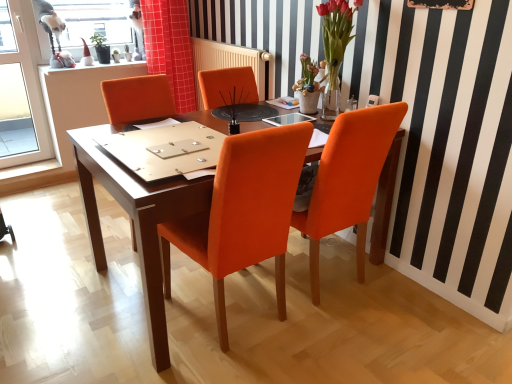
Question: Is wooden bulletin board at upper center surrounding orange leather chair at center, which ranks as the 2th chair in right-to-left order?

Choices:
 (A) yes
 (B) no

Answer: (B)

Question: Is wooden bulletin board at upper center facing towards orange leather chair at center, which ranks as the 2th chair in right-to-left order?

Choices:
 (A) no
 (B) yes

Answer: (A)

Question: Considering the relative positions of wooden bulletin board at upper center and orange leather chair at center, which is the 1th chair from left to right, in the image provided, is wooden bulletin board at upper center to the left of orange leather chair at center, which is the 1th chair from left to right, from the viewer's perspective?

Choices:
 (A) no
 (B) yes

Answer: (A)

Question: Is wooden bulletin board at upper center completely or partially outside of orange leather chair at center, which ranks as the 2th chair in right-to-left order?

Choices:
 (A) no
 (B) yes

Answer: (B)

Question: From the image's perspective, would you say wooden bulletin board at upper center is positioned over orange leather chair at center, which ranks as the 2th chair in right-to-left order?

Choices:
 (A) yes
 (B) no

Answer: (A)

Question: Would you say wooden bulletin board at upper center is inside or outside orange leather chair at center, which is the 1th chair from right to left?

Choices:
 (A) inside
 (B) outside

Answer: (B)

Question: Considering the positions of wooden bulletin board at upper center and orange leather chair at center, which is the 1th chair from right to left, in the image, is wooden bulletin board at upper center taller or shorter than orange leather chair at center, which is the 1th chair from right to left,?

Choices:
 (A) short
 (B) tall

Answer: (A)

Question: Is wooden bulletin board at upper center in front of or behind orange leather chair at center, which is the 1th chair from right to left, in the image?

Choices:
 (A) front
 (B) behind

Answer: (B)

Question: Considering the relative positions of wooden bulletin board at upper center and orange leather chair at center, which is the 1th chair from right to left, in the image provided, is wooden bulletin board at upper center to the left or to the right of orange leather chair at center, which is the 1th chair from right to left,?

Choices:
 (A) left
 (B) right

Answer: (B)

Question: In the image, is orange leather chair at center, which is the 1th chair from left to right, positioned in front of or behind red checkered fabric at upper center?

Choices:
 (A) front
 (B) behind

Answer: (A)

Question: Is point (242, 148) closer or farther from the camera than point (169, 13)?

Choices:
 (A) farther
 (B) closer

Answer: (B)

Question: Considering the positions of orange leather chair at center, which is the 1th chair from left to right, and red checkered fabric at upper center in the image, is orange leather chair at center, which is the 1th chair from left to right, wider or thinner than red checkered fabric at upper center?

Choices:
 (A) thin
 (B) wide

Answer: (B)

Question: In terms of height, does orange leather chair at center, which ranks as the 2th chair in right-to-left order, look taller or shorter compared to red checkered fabric at upper center?

Choices:
 (A) short
 (B) tall

Answer: (B)

Question: From a real-world perspective, relative to red checkered fabric at upper center, is transparent glass table at center vertically above or below?

Choices:
 (A) above
 (B) below

Answer: (B)

Question: Is transparent glass table at center bigger or smaller than red checkered fabric at upper center?

Choices:
 (A) small
 (B) big

Answer: (A)